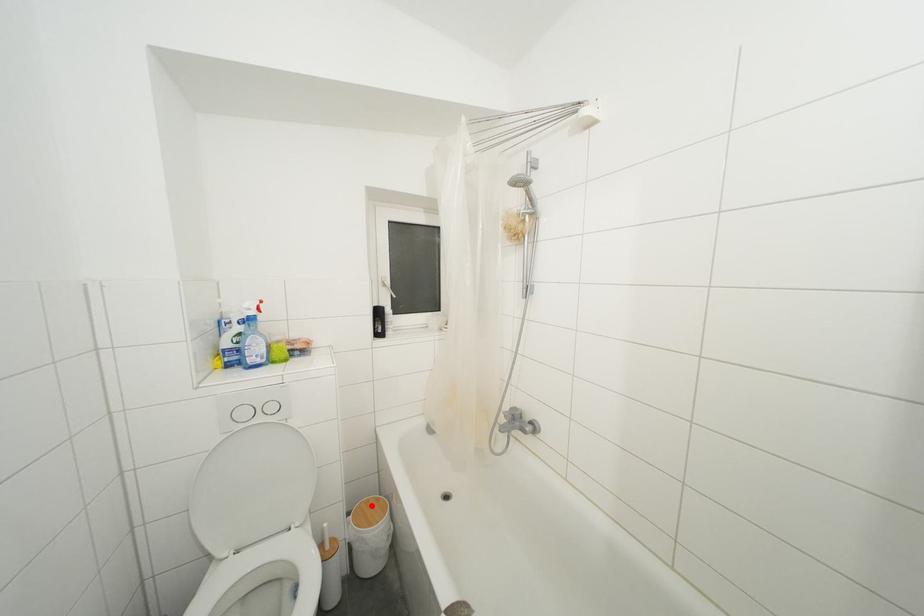
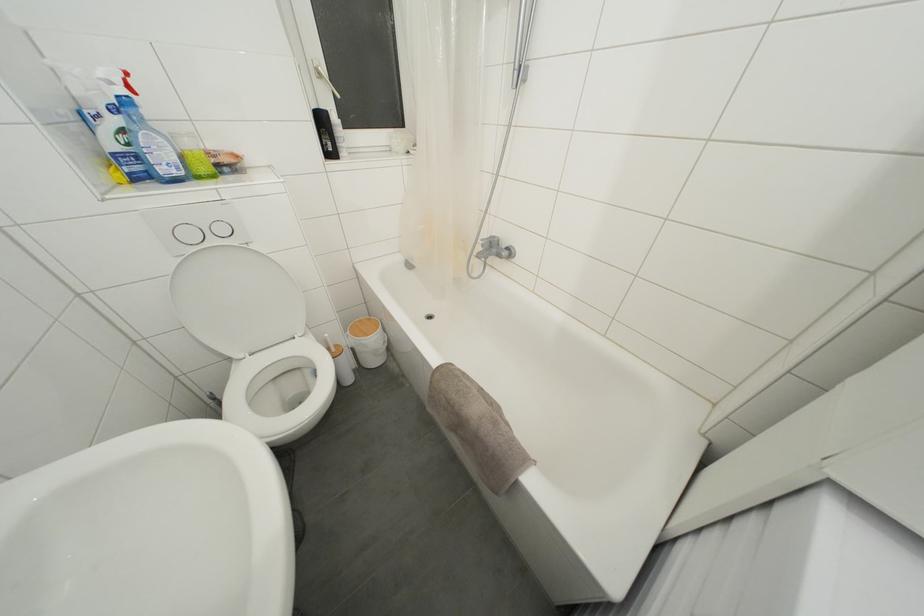
The point at the highlighted location is marked in the first image. Where is the corresponding point in the second image?

(363, 326)